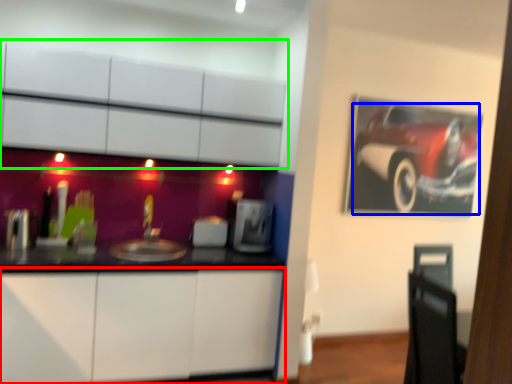
Question: Considering the real-world distances, which object is farthest from cabinetry (highlighted by a red box)? land vehicle (highlighted by a blue box) or cabinetry (highlighted by a green box)?

Choices:
 (A) land vehicle
 (B) cabinetry

Answer: (A)